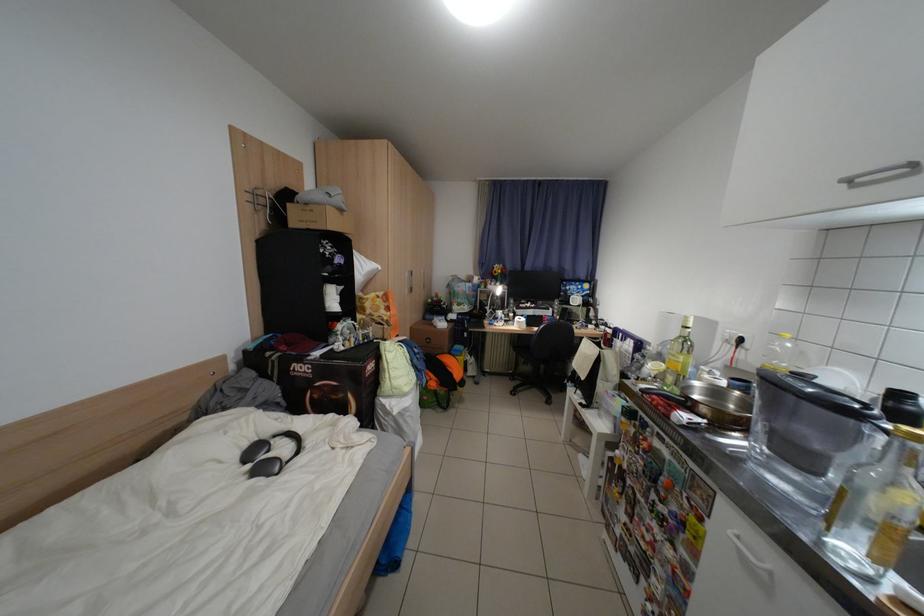
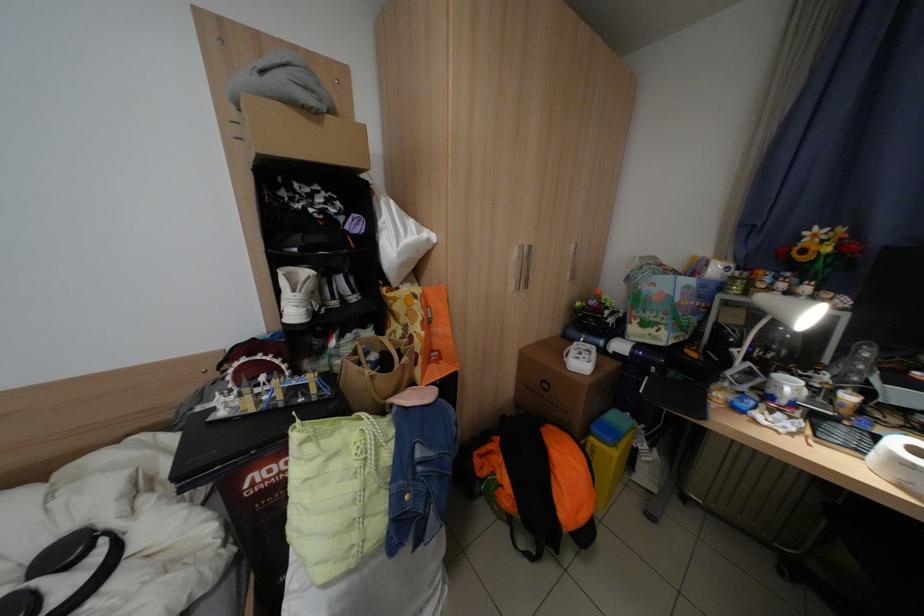
Find the pixel in the second image that matches pixel 512 314 in the first image.

(800, 387)